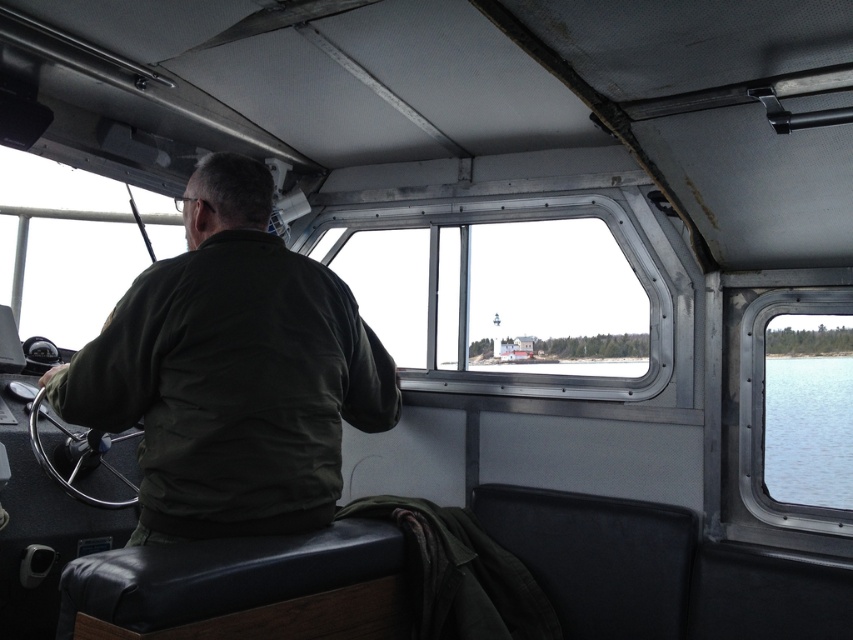
Question: Which point is closer to the camera?

Choices:
 (A) (849, 449)
 (B) (172, 492)

Answer: (B)

Question: Does dark green fabric at center have a lesser width compared to clear glass window at center?

Choices:
 (A) yes
 (B) no

Answer: (A)

Question: Which point is farther to the camera?

Choices:
 (A) dark green fabric at center
 (B) clear glass window at center

Answer: (B)

Question: Which of the following is the closest to the observer?

Choices:
 (A) transparent water at lower right
 (B) clear glass window at right

Answer: (B)

Question: Can you confirm if transparent water at lower right is positioned above clear glass window at right?

Choices:
 (A) yes
 (B) no

Answer: (B)

Question: Is clear glass window at center below transparent water at lower right?

Choices:
 (A) yes
 (B) no

Answer: (B)